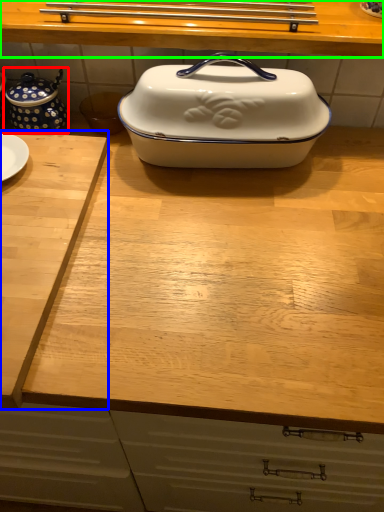
Question: Which object is positioned closest to tea pot (highlighted by a red box)? Select from cutting board (highlighted by a blue box) and countertop (highlighted by a green box).

Choices:
 (A) cutting board
 (B) countertop

Answer: (A)